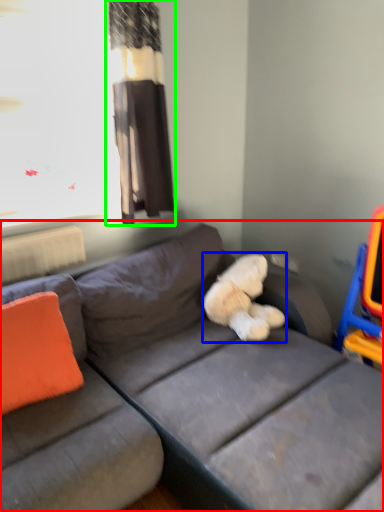
Question: Which object is the closest to the studio couch (highlighted by a red box)? Choose among these: teddy (highlighted by a blue box) or curtain (highlighted by a green box).

Choices:
 (A) teddy
 (B) curtain

Answer: (A)